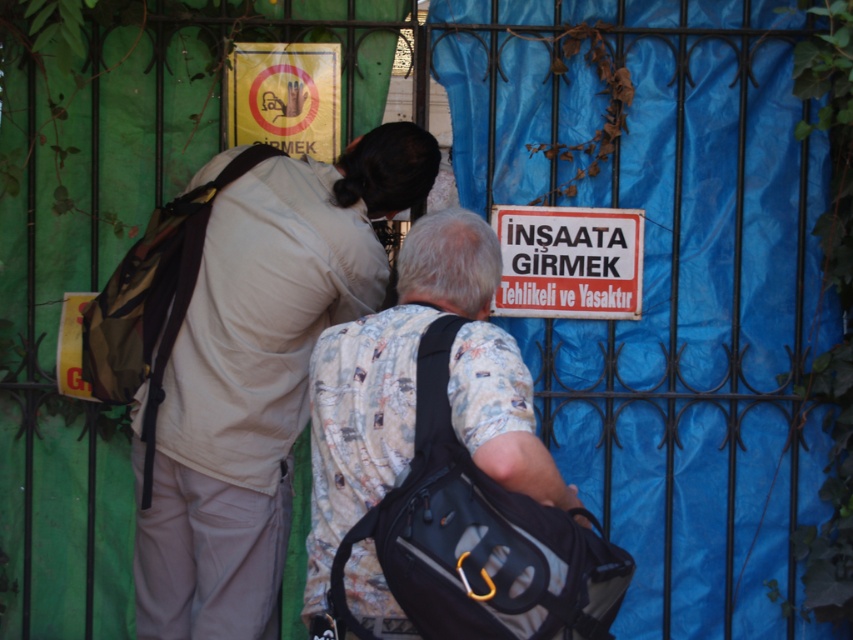
You are a photographer trying to capture a photo of both the matte beige shirt at center and the printed cotton shirt at center. Since you want them both in the frame, which direction should you move to ensure both are visible?

The matte beige shirt at center is positioned on the left side of printed cotton shirt at center, so moving to the right side of both individuals would allow you to capture both in the frame.

You are a delivery person trying to determine the best path to deliver a package. You see a matte beige shirt at center and a yellow paper sign at upper center. Which object is wider so you can navigate around it?

The matte beige shirt at center is wider than the yellow paper sign at upper center, so you should navigate around the matte beige shirt at center to ensure enough space for delivery.

You are standing in front of the metal gate with the two individuals. You notice a specific point marked at coordinates (257, 376). What object is located at that point?

The point at coordinates (257, 376) corresponds to the matte beige shirt at center.